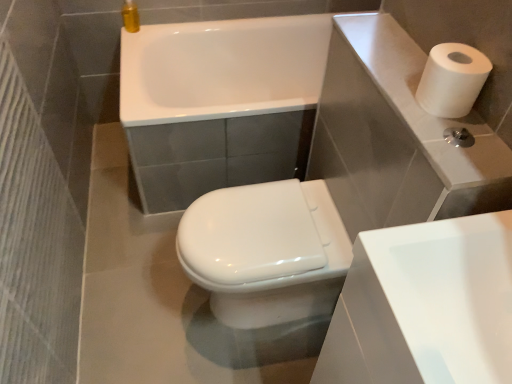
In order to click on free space in front of white matte paper towel at upper right in this screenshot , I will do `click(459, 148)`.